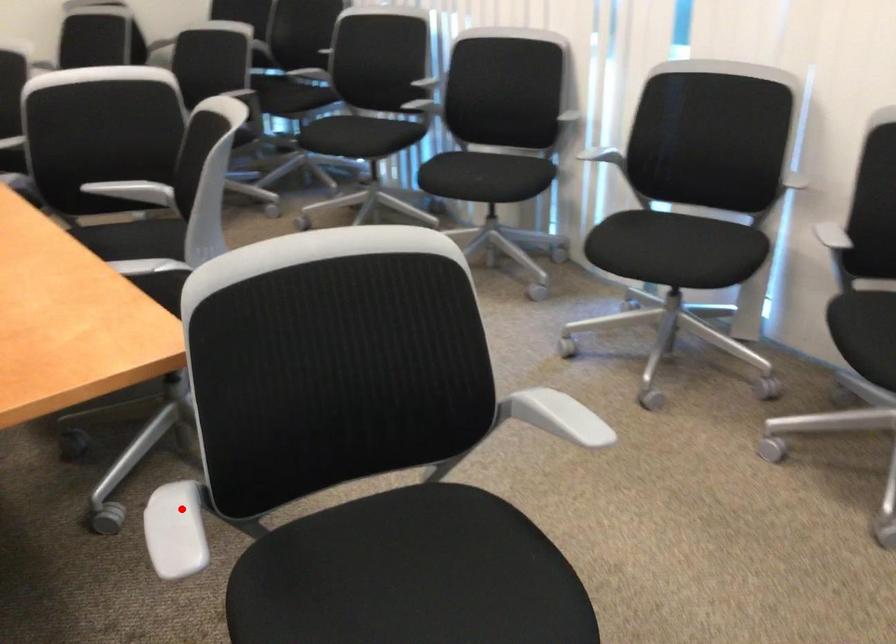
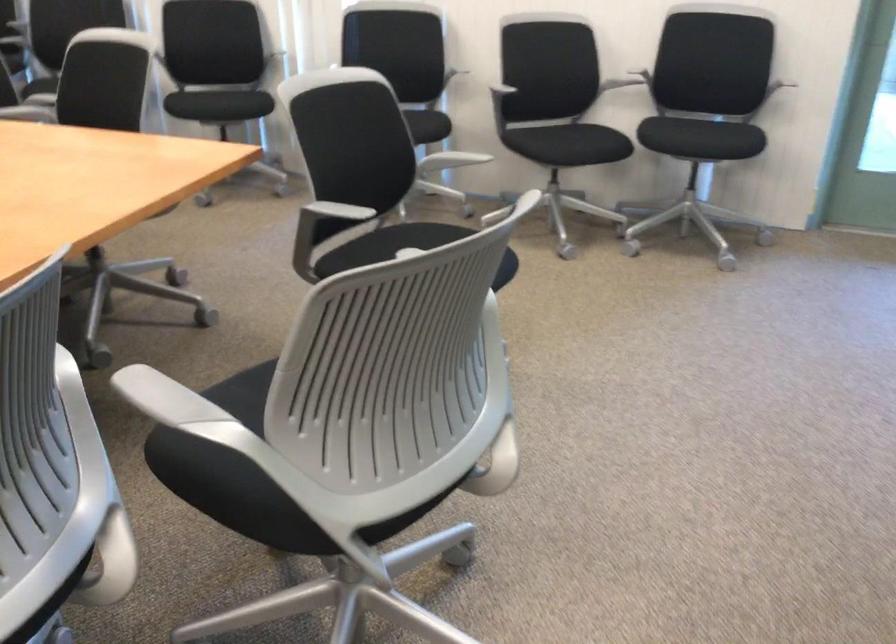
Question: I am providing you with two images of the same scene from different viewpoints. Image1 has a red point marked. In image2, the corresponding 3D location appears at what relative position? Reply with the corresponding letter.

Choices:
 (A) Closer
 (B) Farther

Answer: (B)